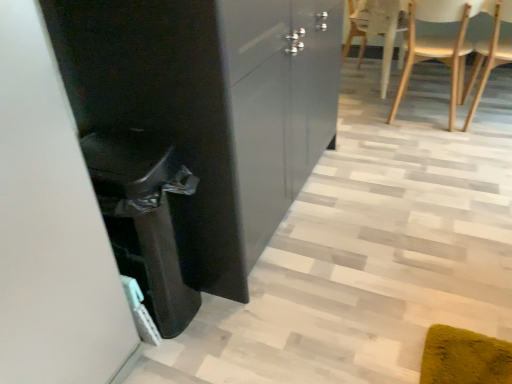
Locate an element on the screen. The image size is (512, 384). white wood chair at upper right, which is the 1th chair from left to right is located at coordinates (438, 45).

Is white wood chair at upper right, which is the 1th chair from left to right, in front of or behind glossy black cabinet at center in the image?

white wood chair at upper right, which is the 1th chair from left to right, is positioned farther from the viewer than glossy black cabinet at center.

Consider the image. Considering the sizes of objects white wood chair at upper right, which is the 2th chair from right to left, and glossy black cabinet at center in the image provided, who is bigger, white wood chair at upper right, which is the 2th chair from right to left, or glossy black cabinet at center?

Bigger between the two is glossy black cabinet at center.

Does point (420, 50) appear closer or farther from the camera than point (257, 193)?

Point (420, 50) is positioned farther from the camera compared to point (257, 193).

Between white wood chair at upper right, which is the 1th chair from left to right, and glossy black cabinet at center, which one has more height?

With more height is glossy black cabinet at center.

Is point (457, 49) closer or farther from the camera than point (476, 105)?

Point (457, 49) is closer to the camera than point (476, 105).

The height and width of the screenshot is (384, 512). I want to click on chair on the left of wooden at right, positioned as the first chair in right-to-left order, so click(x=438, y=45).

What's the angular difference between white wood chair at upper right, which is the 1th chair from left to right, and wooden at right, which is the 2th chair from left to right,'s facing directions?

The angle between the facing direction of white wood chair at upper right, which is the 1th chair from left to right, and the facing direction of wooden at right, which is the 2th chair from left to right, is 0.000165 degrees.

Is white wood chair at upper right, which is the 1th chair from left to right, next to wooden at right, which is the 2th chair from left to right, and touching it?

They are not placed beside each other.

From the image's perspective, between wooden at right, positioned as the first chair in right-to-left order, and white wood chair at upper right, which is the 2th chair from right to left, which one is located above?

From the image's view, white wood chair at upper right, which is the 2th chair from right to left, is above.

Who is bigger, wooden at right, positioned as the first chair in right-to-left order, or white wood chair at upper right, which is the 1th chair from left to right?

white wood chair at upper right, which is the 1th chair from left to right, is bigger.

Looking at this image, which is closer, (x=499, y=33) or (x=402, y=95)?

Point (x=499, y=33) is closer to the camera than point (x=402, y=95).

Looking at this image, from a real-world perspective, does wooden at right, positioned as the first chair in right-to-left order, sit lower than white wood chair at upper right, which is the 1th chair from left to right?

No.

From a real-world perspective, is glossy black cabinet at center on top of wooden at right, which is the 2th chair from left to right?

Yes, from a real-world perspective, glossy black cabinet at center is over wooden at right, which is the 2th chair from left to right

Visually, is glossy black cabinet at center positioned to the left or to the right of wooden at right, which is the 2th chair from left to right?

Clearly, glossy black cabinet at center is on the left of wooden at right, which is the 2th chair from left to right, in the image.

Is glossy black cabinet at center spatially inside wooden at right, which is the 2th chair from left to right, or outside of it?

glossy black cabinet at center is not enclosed by wooden at right, which is the 2th chair from left to right.

How different are the orientations of wooden at right, which is the 2th chair from left to right, and glossy black cabinet at center in degrees?

The facing directions of wooden at right, which is the 2th chair from left to right, and glossy black cabinet at center are 90.3 degrees apart.

From a real-world perspective, is wooden at right, which is the 2th chair from left to right, physically below glossy black cabinet at center?

Yes.

Is point (499, 45) closer or farther from the camera than point (201, 214)?

Point (499, 45) is positioned farther from the camera compared to point (201, 214).

In the scene shown: Which is in front, wooden at right, which is the 2th chair from left to right, or glossy black cabinet at center?

glossy black cabinet at center.

From a real-world perspective, which object stands above the other?

From a 3D spatial view, glossy black cabinet at center is above.

Does glossy black cabinet at center lie behind white wood chair at upper right, which is the 1th chair from left to right?

No, it is not.

Is glossy black cabinet at center not within white wood chair at upper right, which is the 2th chair from right to left?

Yes, glossy black cabinet at center is outside of white wood chair at upper right, which is the 2th chair from right to left.

Between glossy black cabinet at center and white wood chair at upper right, which is the 1th chair from left to right, which one appears on the left side from the viewer's perspective?

glossy black cabinet at center.

Find the location of a particular element. cabinetry above the white wood chair at upper right, which is the 1th chair from left to right (from a real-world perspective) is located at coordinates (198, 129).

You are a GUI agent. You are given a task and a screenshot of the screen. Output one action in this format:
    pyautogui.click(x=<x>, y=<y>)
    Task: Click on the chair on the left side of wooden at right, positioned as the first chair in right-to-left order
    This screenshot has width=512, height=384.
    Given the screenshot: What is the action you would take?
    pyautogui.click(x=438, y=45)

When comparing their distances from glossy black cabinet at center, does wooden at right, which is the 2th chair from left to right, or white wood chair at upper right, which is the 2th chair from right to left, seem closer?

Among the two, white wood chair at upper right, which is the 2th chair from right to left, is located nearer to glossy black cabinet at center.

From the image, which object appears to be farther from wooden at right, which is the 2th chair from left to right, glossy black cabinet at center or white wood chair at upper right, which is the 1th chair from left to right?

The object further to wooden at right, which is the 2th chair from left to right, is glossy black cabinet at center.

Estimate the real-world distances between objects in this image. Which object is closer to white wood chair at upper right, which is the 1th chair from left to right, glossy black cabinet at center or wooden at right, positioned as the first chair in right-to-left order?

wooden at right, positioned as the first chair in right-to-left order, is positioned closer to the anchor white wood chair at upper right, which is the 1th chair from left to right.

When comparing their distances from wooden at right, positioned as the first chair in right-to-left order, does white wood chair at upper right, which is the 2th chair from right to left, or glossy black cabinet at center seem further?

glossy black cabinet at center lies further to wooden at right, positioned as the first chair in right-to-left order, than the other object.

Estimate the real-world distances between objects in this image. Which object is further from white wood chair at upper right, which is the 1th chair from left to right, wooden at right, which is the 2th chair from left to right, or glossy black cabinet at center?

glossy black cabinet at center is positioned further to the anchor white wood chair at upper right, which is the 1th chair from left to right.

Estimate the real-world distances between objects in this image. Which object is closer to glossy black cabinet at center, white wood chair at upper right, which is the 2th chair from right to left, or wooden at right, positioned as the first chair in right-to-left order?

white wood chair at upper right, which is the 2th chair from right to left, is positioned closer to the anchor glossy black cabinet at center.

At what (x,y) coordinates should I click in order to perform the action: click on chair between glossy black cabinet at center and wooden at right, positioned as the first chair in right-to-left order. Please return your answer as a coordinate pair (x, y). The image size is (512, 384). Looking at the image, I should click on (438, 45).